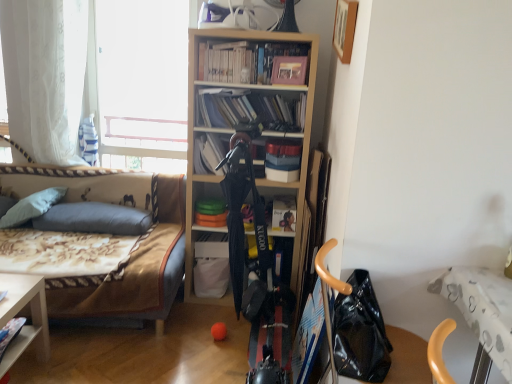
What is the approximate height of floral fabric couch at left?

28.95 inches.

This screenshot has width=512, height=384. Describe the element at coordinates (208, 154) in the screenshot. I see `matte black book at center, which ranks as the 3th book in top-to-bottom order` at that location.

Find the location of a particular element. The image size is (512, 384). matte plastic books at center, marked as the 2th book in a top-to-bottom arrangement is located at coordinates (249, 110).

Would you say matte plastic books at center, marked as the 2th book in a top-to-bottom arrangement, is outside hardcover books at upper center, positioned as the fourth book in bottom-to-top order?

Absolutely, matte plastic books at center, marked as the 2th book in a top-to-bottom arrangement, is external to hardcover books at upper center, positioned as the fourth book in bottom-to-top order.

Is matte plastic books at center, marked as the 2th book in a top-to-bottom arrangement, far from hardcover books at upper center, positioned as the fourth book in bottom-to-top order?

No, there isn't a large distance between matte plastic books at center, marked as the 2th book in a top-to-bottom arrangement, and hardcover books at upper center, positioned as the fourth book in bottom-to-top order.

In the image, is matte plastic books at center, marked as the 2th book in a top-to-bottom arrangement, positioned in front of or behind hardcover books at upper center, the 1th book from the top?

Visually, matte plastic books at center, marked as the 2th book in a top-to-bottom arrangement, is located behind hardcover books at upper center, the 1th book from the top.

Does matte plastic books at center, which is counted as the 3th book, starting from the bottom, have a greater width compared to hardcover books at upper center, positioned as the fourth book in bottom-to-top order?

Correct, the width of matte plastic books at center, which is counted as the 3th book, starting from the bottom, exceeds that of hardcover books at upper center, positioned as the fourth book in bottom-to-top order.

Identify the location of the 4th book above when counting from the black leather handbag at lower right (from the image's perspective). (253, 63).

Is hardcover books at upper center, positioned as the fourth book in bottom-to-top order, to the left or to the right of black leather handbag at lower right in the image?

Based on their positions, hardcover books at upper center, positioned as the fourth book in bottom-to-top order, is located to the left of black leather handbag at lower right.

Is hardcover books at upper center, the 1th book from the top, aimed at black leather handbag at lower right?

No, hardcover books at upper center, the 1th book from the top, is not facing towards black leather handbag at lower right.

Considering the positions of objects matte plastic books at center, which is counted as the 3th book, starting from the bottom, and white matte book at center, the fourth book positioned from the top, in the image provided, who is behind, matte plastic books at center, which is counted as the 3th book, starting from the bottom, or white matte book at center, the fourth book positioned from the top,?

white matte book at center, the fourth book positioned from the top, is further away from the camera.

Is white matte book at center, the fourth book positioned from the top, completely or partially inside matte plastic books at center, which is counted as the 3th book, starting from the bottom?

Definitely not — white matte book at center, the fourth book positioned from the top, is not inside matte plastic books at center, which is counted as the 3th book, starting from the bottom.

Considering the sizes of objects matte plastic books at center, marked as the 2th book in a top-to-bottom arrangement, and white matte book at center, the first book positioned from the bottom, in the image provided, who is bigger, matte plastic books at center, marked as the 2th book in a top-to-bottom arrangement, or white matte book at center, the first book positioned from the bottom,?

With larger size is matte plastic books at center, marked as the 2th book in a top-to-bottom arrangement.

From a real-world perspective, which is physically above, matte plastic books at center, marked as the 2th book in a top-to-bottom arrangement, or white matte book at center, the fourth book positioned from the top?

matte plastic books at center, marked as the 2th book in a top-to-bottom arrangement, is physically above.

This screenshot has height=384, width=512. I want to click on studio couch in front of the orange matte ball at center, so click(x=101, y=244).

Is orange matte ball at center not inside floral fabric couch at left?

Yes, orange matte ball at center is outside of floral fabric couch at left.

Is orange matte ball at center bigger or smaller than floral fabric couch at left?

Clearly, orange matte ball at center is smaller in size than floral fabric couch at left.

How different are the orientations of orange matte ball at center and floral fabric couch at left in degrees?

They differ by 6.22 degrees in their facing directions.

Based on the photo, can you confirm if matte plastic books at center, which is counted as the 3th book, starting from the bottom, is positioned to the left of white sheer curtain at left?

No.

Which of these two, matte plastic books at center, which is counted as the 3th book, starting from the bottom, or white sheer curtain at left, is wider?

Wider between the two is matte plastic books at center, which is counted as the 3th book, starting from the bottom.

From a real-world perspective, between matte plastic books at center, which is counted as the 3th book, starting from the bottom, and white sheer curtain at left, who is vertically higher?

white sheer curtain at left.

What's the angular difference between black leather handbag at lower right and light wood bookcase at center's facing directions?

The angular difference between black leather handbag at lower right and light wood bookcase at center is 73.4 degrees.

Considering the relative sizes of black leather handbag at lower right and light wood bookcase at center in the image provided, is black leather handbag at lower right shorter than light wood bookcase at center?

Yes, black leather handbag at lower right is shorter than light wood bookcase at center.

Considering the relative positions of black leather handbag at lower right and light wood bookcase at center in the image provided, is black leather handbag at lower right in front of light wood bookcase at center?

Yes, black leather handbag at lower right is in front of light wood bookcase at center.

From a real-world perspective, relative to light wood bookcase at center, is black leather handbag at lower right vertically above or below?

Clearly, from a real-world perspective, black leather handbag at lower right is below light wood bookcase at center.

Considering the relative sizes of hardcover books at upper center, positioned as the fourth book in bottom-to-top order, and white sheer curtain at left in the image provided, is hardcover books at upper center, positioned as the fourth book in bottom-to-top order, taller than white sheer curtain at left?

No, hardcover books at upper center, positioned as the fourth book in bottom-to-top order, is not taller than white sheer curtain at left.

Is hardcover books at upper center, the 1th book from the top, to the left or to the right of white sheer curtain at left in the image?

Clearly, hardcover books at upper center, the 1th book from the top, is on the right of white sheer curtain at left in the image.

Which is in front, hardcover books at upper center, the 1th book from the top, or white sheer curtain at left?

hardcover books at upper center, the 1th book from the top.

Does hardcover books at upper center, the 1th book from the top, contain white sheer curtain at left?

No, hardcover books at upper center, the 1th book from the top, does not contain white sheer curtain at left.

At what (x,y) coordinates should I click in order to perform the action: click on book above the matte plastic books at center, which is counted as the 3th book, starting from the bottom (from a real-world perspective). Please return your answer as a coordinate pair (x, y). This screenshot has width=512, height=384. Looking at the image, I should click on (253, 63).

In the image, there is a hardcover books at upper center, the 1th book from the top. Identify the location of handbag below it (from the image's perspective). (360, 332).

Based on their spatial positions, is matte plastic books at center, marked as the 2th book in a top-to-bottom arrangement, or wooden picture frame at upper right further from matte gray pillow at left, marked as the second pillow in a left-to-right arrangement?

wooden picture frame at upper right is further to matte gray pillow at left, marked as the second pillow in a left-to-right arrangement.

Estimate the real-world distances between objects in this image. Which object is further from light wood bookcase at center, matte gray pillow at left, marked as the second pillow in a left-to-right arrangement, or matte plastic books at center, marked as the 2th book in a top-to-bottom arrangement?

Based on the image, matte gray pillow at left, marked as the second pillow in a left-to-right arrangement, appears to be further to light wood bookcase at center.

Looking at the image, which one is located further to matte plastic books at center, which is counted as the 3th book, starting from the bottom, white soft pillow at left, acting as the 2th pillow starting from the right, or wooden picture frame at upper right?

Among the two, white soft pillow at left, acting as the 2th pillow starting from the right, is located further to matte plastic books at center, which is counted as the 3th book, starting from the bottom.

Estimate the real-world distances between objects in this image. Which object is closer to black leather handbag at lower right, hardcover books at upper center, positioned as the fourth book in bottom-to-top order, or light wood bookcase at center?

Among the two, light wood bookcase at center is located nearer to black leather handbag at lower right.

Looking at the image, which one is located closer to hardcover books at upper center, the 1th book from the top, matte gray pillow at left, marked as the second pillow in a left-to-right arrangement, or floral fabric couch at left?

floral fabric couch at left lies closer to hardcover books at upper center, the 1th book from the top, than the other object.

From the picture: Based on their spatial positions, is orange matte ball at center or matte plastic books at center, which is counted as the 3th book, starting from the bottom, further from light wood bookcase at center?

orange matte ball at center is further to light wood bookcase at center.

Estimate the real-world distances between objects in this image. Which object is further from white soft pillow at left, acting as the 2th pillow starting from the right, white sheer curtain at left or wooden picture frame at upper right?

wooden picture frame at upper right is positioned further to the anchor white soft pillow at left, acting as the 2th pillow starting from the right.

In the scene shown: Estimate the real-world distances between objects in this image. Which object is further from floral fabric couch at left, wooden picture frame at upper right or matte gray pillow at left, marked as the second pillow in a left-to-right arrangement?

Based on the image, wooden picture frame at upper right appears to be further to floral fabric couch at left.

The width and height of the screenshot is (512, 384). What are the coordinates of `studio couch between white sheer curtain at left and wooden picture frame at upper right from left to right` in the screenshot? It's located at (101, 244).

Where is `bookcase positioned between black leather handbag at lower right and matte black book at center, which ranks as the 3th book in top-to-bottom order, from near to far`? bookcase positioned between black leather handbag at lower right and matte black book at center, which ranks as the 3th book in top-to-bottom order, from near to far is located at coordinates (233, 131).

Locate an element on the screen. This screenshot has height=384, width=512. ball located between floral fabric couch at left and black leather handbag at lower right in the left-right direction is located at coordinates (219, 331).

Image resolution: width=512 pixels, height=384 pixels. In order to click on pillow located between floral fabric couch at left and black leather handbag at lower right in the left-right direction in this screenshot , I will do (94, 219).